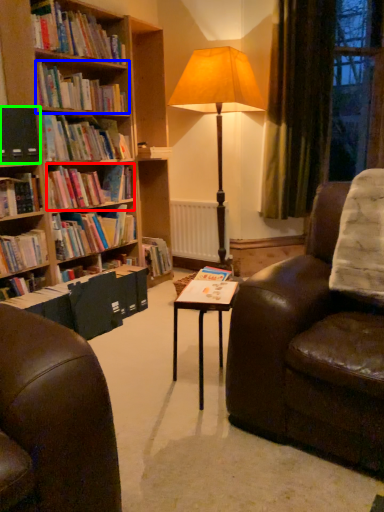
Question: Considering the real-world distances, which object is farthest from book (highlighted by a red box)? book (highlighted by a blue box) or paperback book (highlighted by a green box)?

Choices:
 (A) book
 (B) paperback book

Answer: (A)